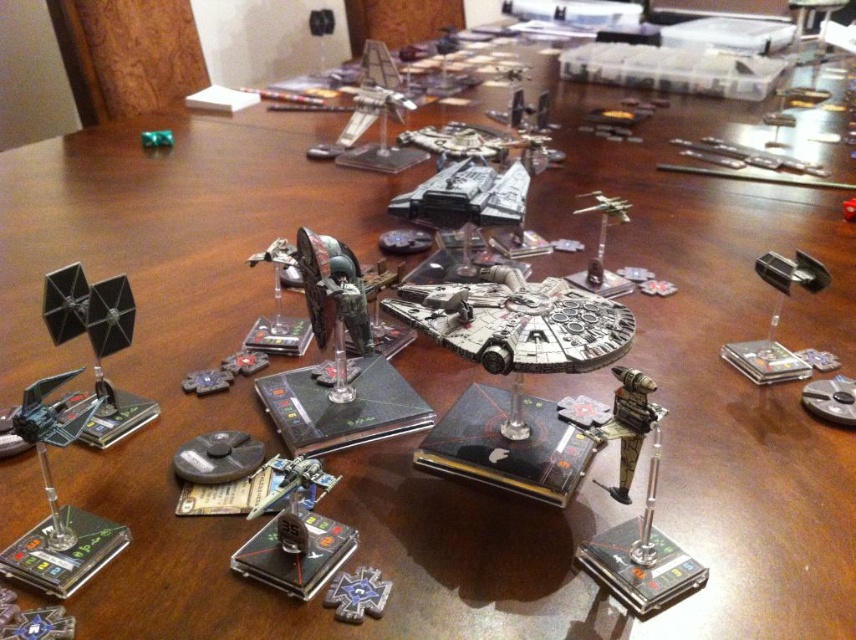
Question: Can you confirm if metallic silver spaceship at lower left is bigger than metallic silver starfighter at upper right?

Choices:
 (A) yes
 (B) no

Answer: (B)

Question: Is metallic silver spaceship at lower left below metallic silver star at center?

Choices:
 (A) no
 (B) yes

Answer: (A)

Question: Does metallic silver spaceship at lower left appear under metallic silver star at center?

Choices:
 (A) no
 (B) yes

Answer: (A)

Question: Which object is farther from the camera taking this photo?

Choices:
 (A) metallic silver star at center
 (B) metallic silver starfighter at upper right
 (C) metallic silver spaceship at lower left

Answer: (B)

Question: Among these objects, which one is farthest from the camera?

Choices:
 (A) metallic silver starfighter at upper right
 (B) metallic silver spaceship at lower left

Answer: (A)

Question: Which object appears farthest from the camera in this image?

Choices:
 (A) metallic silver starfighter at upper right
 (B) metallic silver spaceship at lower left
 (C) metallic silver star at center

Answer: (A)